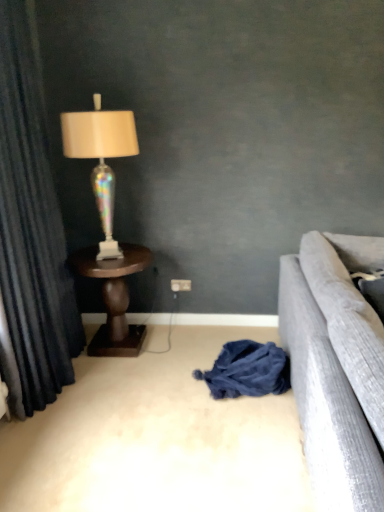
Question: Considering the relative positions of dark blue velvet curtain at left and white plastic power outlet at center in the image provided, is dark blue velvet curtain at left to the right of white plastic power outlet at center from the viewer's perspective?

Choices:
 (A) yes
 (B) no

Answer: (B)

Question: Are dark blue velvet curtain at left and white plastic power outlet at center far apart?

Choices:
 (A) no
 (B) yes

Answer: (B)

Question: Considering the relative sizes of dark blue velvet curtain at left and white plastic power outlet at center in the image provided, is dark blue velvet curtain at left taller than white plastic power outlet at center?

Choices:
 (A) no
 (B) yes

Answer: (B)

Question: Is dark blue velvet curtain at left further to the viewer compared to white plastic power outlet at center?

Choices:
 (A) no
 (B) yes

Answer: (A)

Question: Considering the relative sizes of dark blue velvet curtain at left and white plastic power outlet at center in the image provided, is dark blue velvet curtain at left bigger than white plastic power outlet at center?

Choices:
 (A) yes
 (B) no

Answer: (A)

Question: From the image's perspective, is dark blue velvet curtain at left under white plastic power outlet at center?

Choices:
 (A) no
 (B) yes

Answer: (A)

Question: Is dark blue velvet curtain at left far away from iridescent glass lamp at left?

Choices:
 (A) no
 (B) yes

Answer: (A)

Question: Is the depth of dark blue velvet curtain at left greater than that of iridescent glass lamp at left?

Choices:
 (A) no
 (B) yes

Answer: (A)

Question: Does dark blue velvet curtain at left contain iridescent glass lamp at left?

Choices:
 (A) no
 (B) yes

Answer: (A)

Question: Does dark blue velvet curtain at left have a greater width compared to iridescent glass lamp at left?

Choices:
 (A) yes
 (B) no

Answer: (B)

Question: Is dark blue velvet curtain at left to the right of iridescent glass lamp at left from the viewer's perspective?

Choices:
 (A) yes
 (B) no

Answer: (B)

Question: From the image's perspective, is dark blue velvet curtain at left above iridescent glass lamp at left?

Choices:
 (A) no
 (B) yes

Answer: (A)

Question: From a real-world perspective, is brown wooden table at left beneath dark blue velvet curtain at left?

Choices:
 (A) yes
 (B) no

Answer: (A)